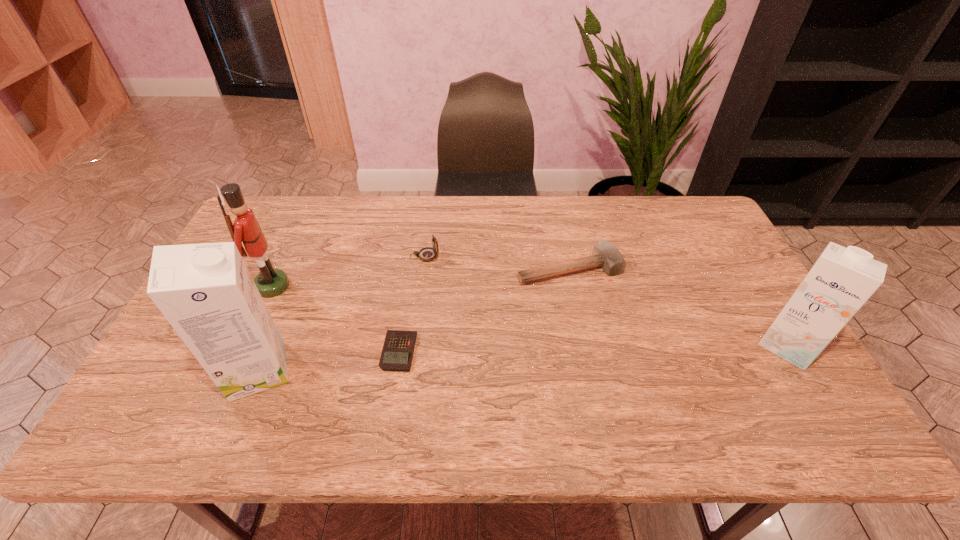
This screenshot has width=960, height=540. In order to click on free space between the mallet and the taller carton in this screenshot , I will do `click(414, 320)`.

Identify the location of free spot between the second shortest object and the calculator. (484, 310).

Locate an element on the screen. vacant space that is in between the fourth tallest object and the rightmost object is located at coordinates (607, 301).

This screenshot has width=960, height=540. I want to click on empty location between the left carton and the shortest object, so click(328, 361).

Find the location of `blank region between the nutcracker and the compass`. blank region between the nutcracker and the compass is located at coordinates (348, 271).

Locate an element on the screen. This screenshot has height=540, width=960. vacant area that lies between the rightmost object and the mallet is located at coordinates (679, 307).

Choose which object is the nearest neighbor to the compass. Please provide its 2D coordinates. Your answer should be formatted as a tuple, i.e. [(x, y)], where the tuple contains the x and y coordinates of a point satisfying the conditions above.

[(606, 255)]

Identify the location of the fifth closest object relative to the compass. This screenshot has width=960, height=540. point(840,282).

Locate an element on the screen. This screenshot has height=540, width=960. free location that satisfies the following two spatial constraints: 1. on the front-facing side of the nutcracker; 2. on the left side of the rightmost object is located at coordinates pos(246,345).

Image resolution: width=960 pixels, height=540 pixels. Find the location of `free point that satisfies the following two spatial constraints: 1. on the front-facing side of the taller carton; 2. on the right side of the nutcracker`. free point that satisfies the following two spatial constraints: 1. on the front-facing side of the taller carton; 2. on the right side of the nutcracker is located at coordinates (234, 370).